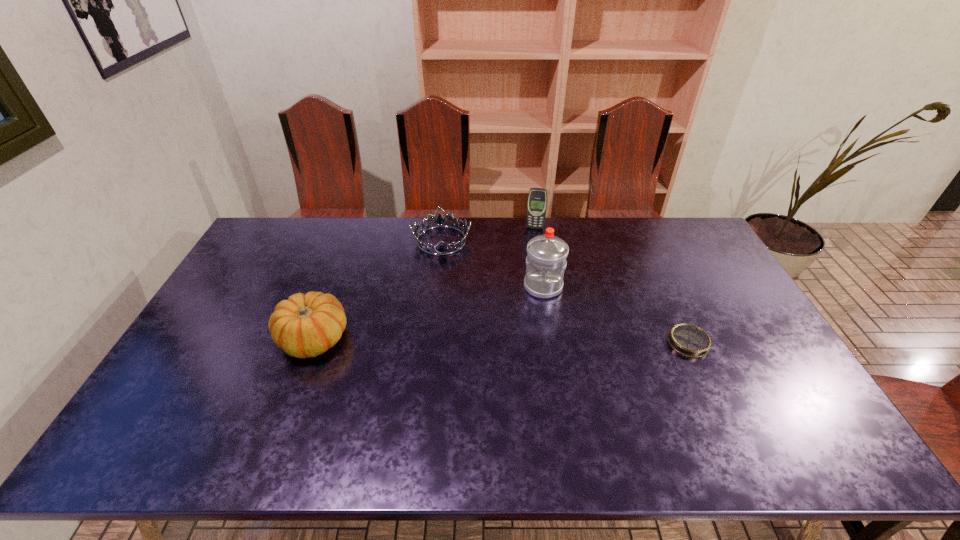
I want to click on empty space that is in between the second tallest object and the gourd, so click(424, 284).

This screenshot has height=540, width=960. What are the coordinates of `empty location between the rightmost object and the second shortest object` in the screenshot? It's located at (564, 292).

Identify the location of vacant point located between the compass and the second tallest object. The height and width of the screenshot is (540, 960). (612, 285).

Locate an element on the screen. The width and height of the screenshot is (960, 540). free point between the second object from left to right and the third nearest object is located at coordinates (492, 264).

Find the location of a particular element. empty location between the second object from left to right and the cellular telephone is located at coordinates (489, 234).

This screenshot has height=540, width=960. Identify the location of empty space between the shortest object and the third shortest object. (501, 340).

At what (x,y) coordinates should I click in order to perform the action: click on vacant area that lies between the fourth tallest object and the shortest object. Please return your answer as a coordinate pair (x, y). This screenshot has width=960, height=540. Looking at the image, I should click on (564, 292).

This screenshot has width=960, height=540. I want to click on vacant region between the second shortest object and the third nearest object, so click(492, 264).

Identify which object is the fourth closest to the gourd. Please provide its 2D coordinates. Your answer should be formatted as a tuple, i.e. [(x, y)], where the tuple contains the x and y coordinates of a point satisfying the conditions above.

[(689, 340)]

Find the location of a particular element. The width and height of the screenshot is (960, 540). object that can be found as the closest to the rightmost object is located at coordinates (546, 260).